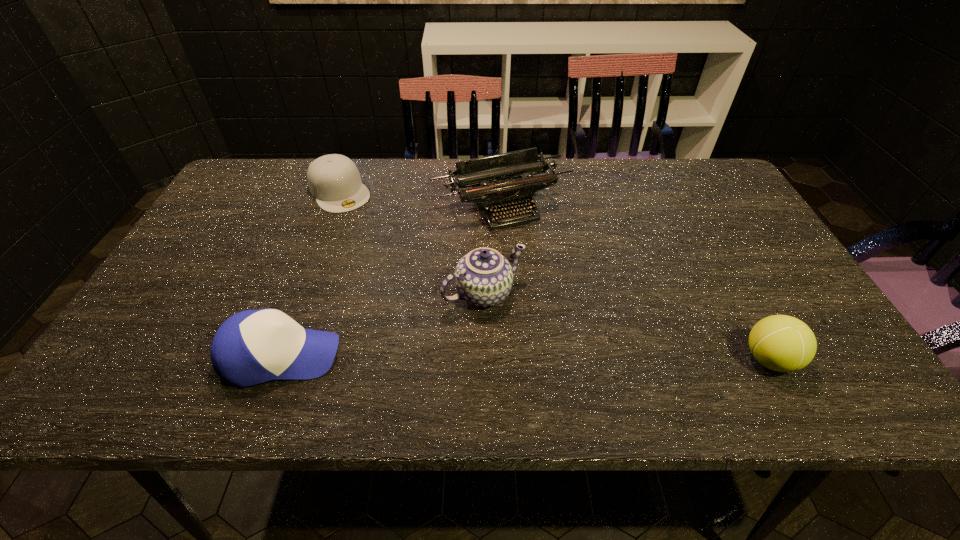
The image size is (960, 540). I want to click on object that is positioned at the near right corner, so [x=782, y=343].

The image size is (960, 540). I want to click on vacant space at the far edge, so click(x=292, y=190).

This screenshot has width=960, height=540. What are the coordinates of `free space at the near edge` in the screenshot? It's located at (482, 338).

Identify the location of blank space at the left edge. The height and width of the screenshot is (540, 960). (227, 226).

You are a GUI agent. You are given a task and a screenshot of the screen. Output one action in this format:
    pyautogui.click(x=<x>, y=<y>)
    Task: Click on the free region at the right edge
    
    Given the screenshot: What is the action you would take?
    pyautogui.click(x=771, y=282)

In the image, there is a desktop. Identify the location of vacant space at the near right corner. (819, 343).

Where is `vacant area that lies between the cap and the tennis ball`? vacant area that lies between the cap and the tennis ball is located at coordinates (554, 275).

Where is `vacant space that is in between the rightmost object and the typewriter`? vacant space that is in between the rightmost object and the typewriter is located at coordinates (635, 283).

Locate an element on the screen. Image resolution: width=960 pixels, height=540 pixels. vacant space that's between the tennis ball and the cap is located at coordinates (554, 275).

The width and height of the screenshot is (960, 540). Identify the location of free spot between the chinaware and the baseball cap. (382, 325).